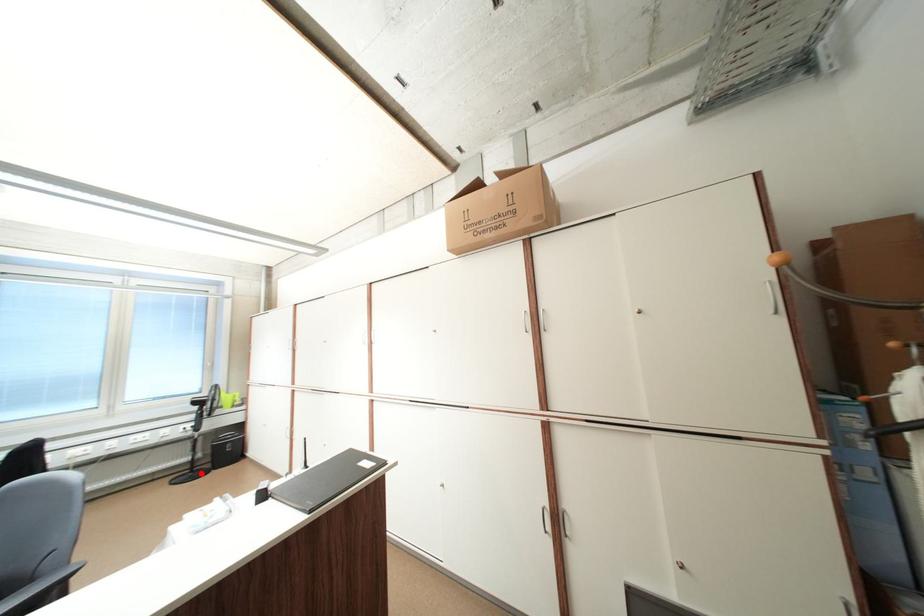
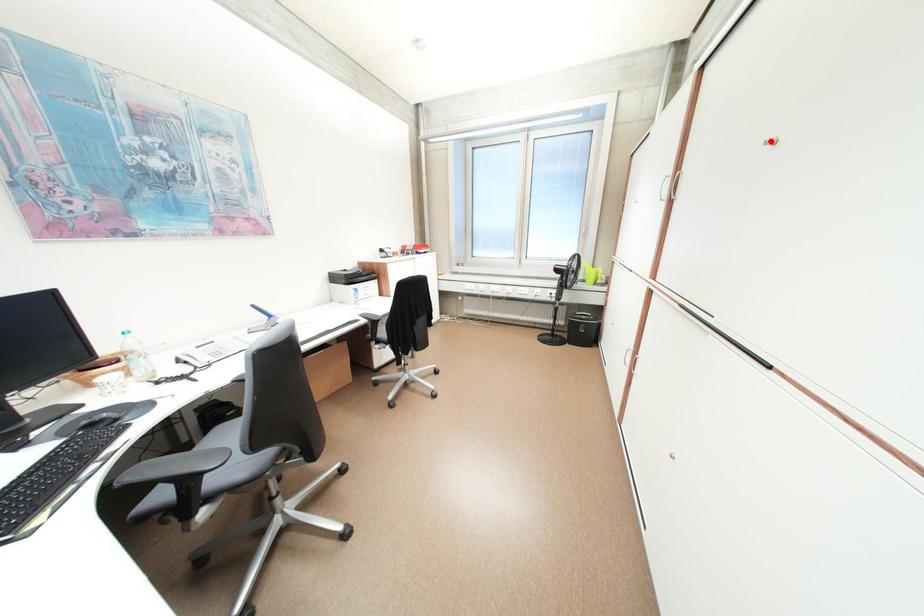
I am providing you with two images of the same scene from different viewpoints. A red point is marked on the first image and another point is marked on the second image. Is the red point in image1 aligned with the point shown in image2?

No